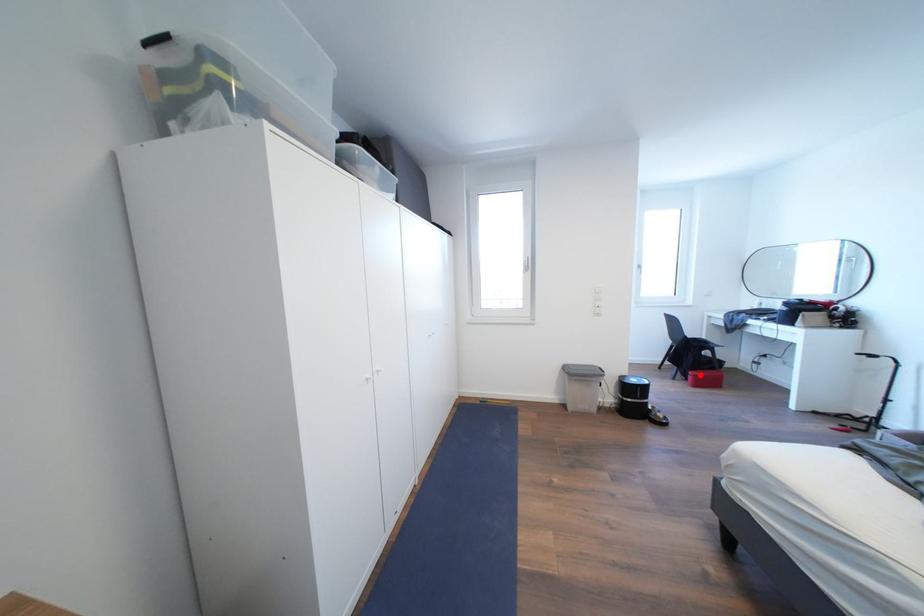
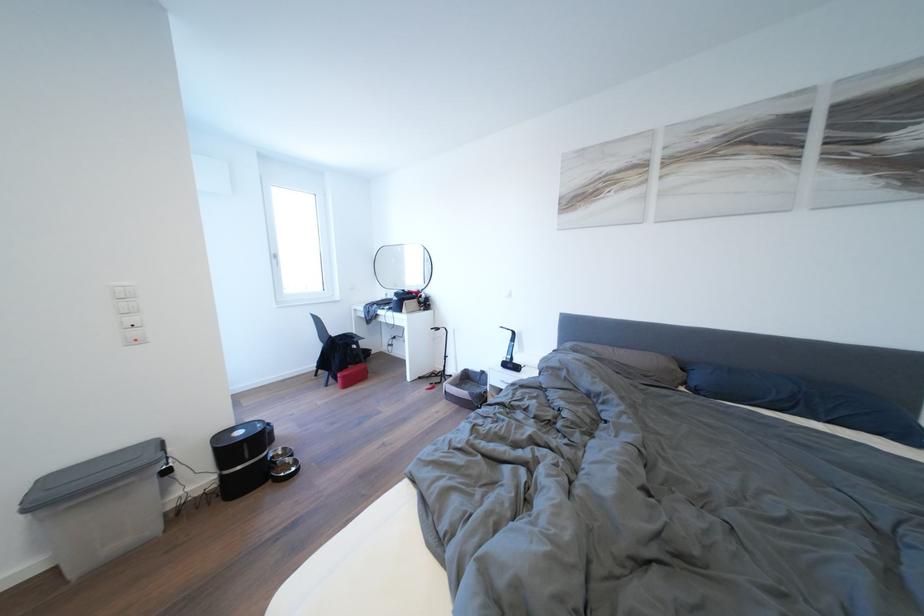
In the second image, find the point that corresponds to the highlighted location in the first image.

(348, 376)